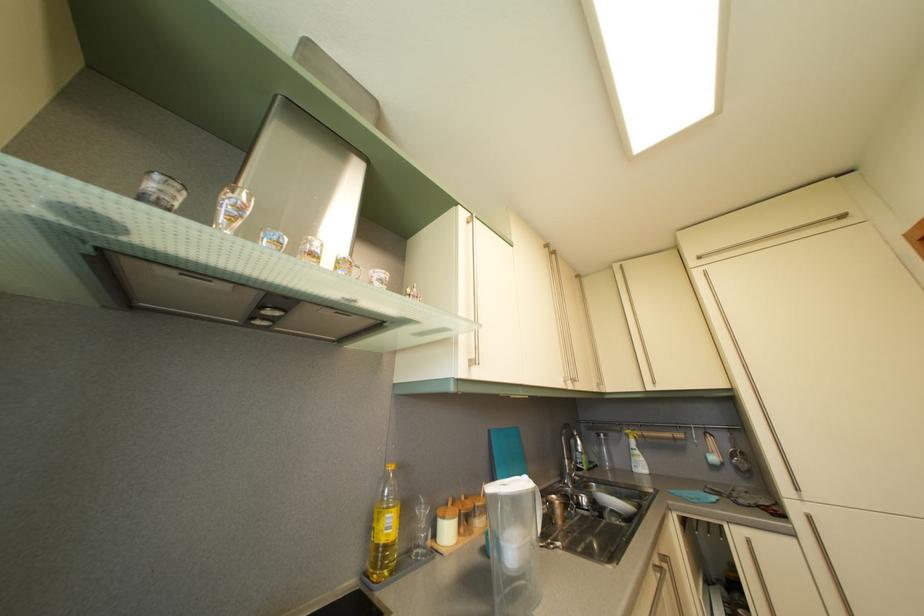
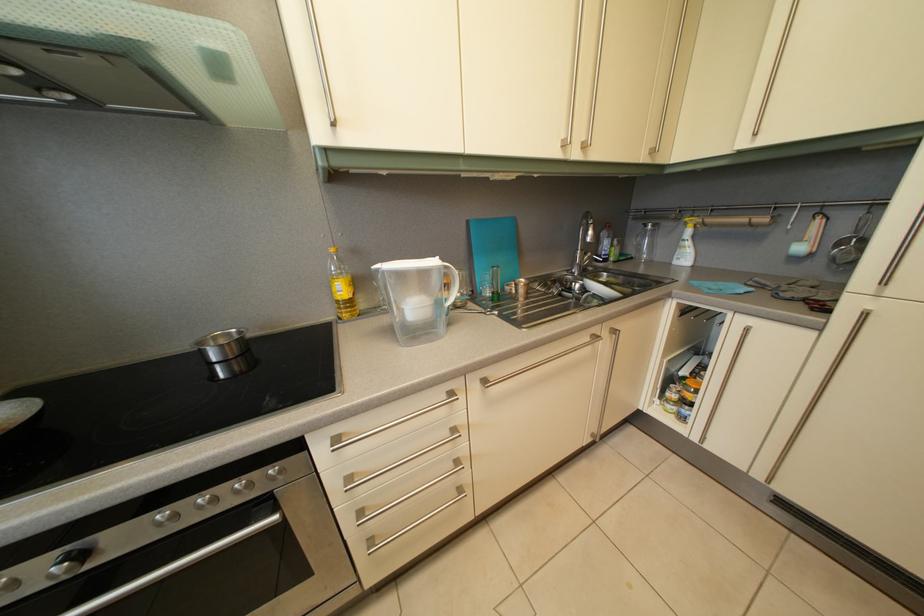
Find the pixel in the second image that matches pixel 521 554 in the first image.

(421, 315)